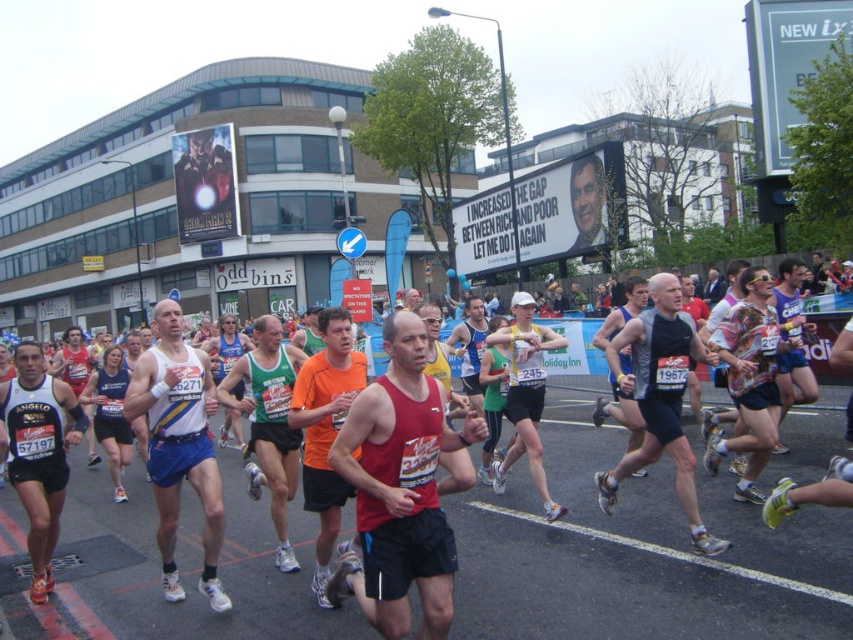
Question: Is red fabric tank top at center thinner than red tank top at center?

Choices:
 (A) yes
 (B) no

Answer: (A)

Question: Among these objects, which one is farthest from the camera?

Choices:
 (A) green jersey at center
 (B) red fabric tank top at center
 (C) smooth skin face at center
 (D) red tank top at center

Answer: (C)

Question: Which point is farther to the camera?

Choices:
 (A) red tank top at center
 (B) orange fabric shirt at center

Answer: (A)

Question: Is the position of white mesh tank top at center less distant than that of green jersey at center?

Choices:
 (A) yes
 (B) no

Answer: (B)

Question: Can you confirm if red fabric tank top at center is positioned below matte black jacket at center?

Choices:
 (A) yes
 (B) no

Answer: (A)

Question: Which point appears farthest from the camera in this image?

Choices:
 (A) pyautogui.click(x=424, y=348)
 (B) pyautogui.click(x=582, y=161)
 (C) pyautogui.click(x=318, y=369)

Answer: (B)